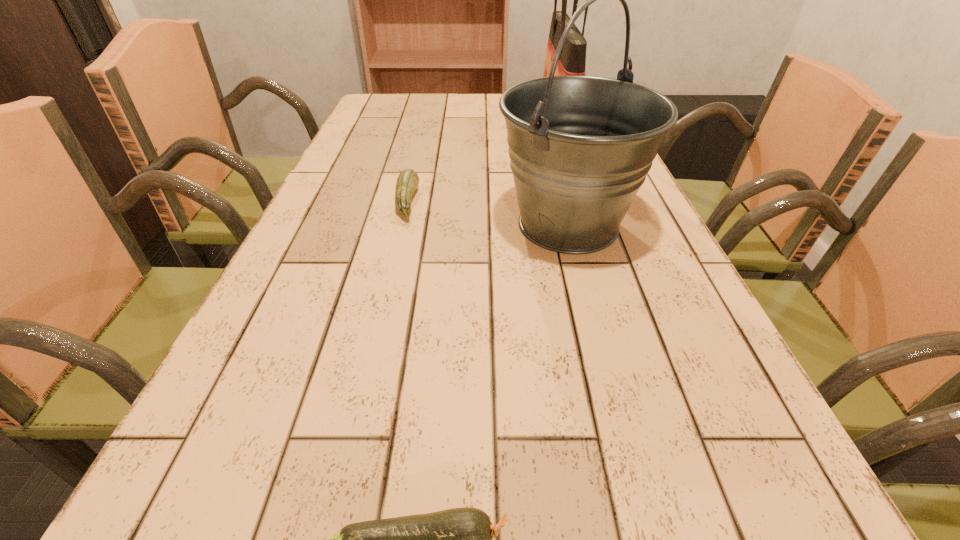
Where is `shopping bag that is at the right edge`? This screenshot has width=960, height=540. shopping bag that is at the right edge is located at coordinates (572, 61).

At what (x,y) coordinates should I click in order to perform the action: click on bucket present at the right edge. Please return your answer as a coordinate pair (x, y). Looking at the image, I should click on (580, 147).

In order to click on object at the far right corner in this screenshot , I will do tap(572, 61).

Where is `free space at the far edge of the desktop`? This screenshot has width=960, height=540. free space at the far edge of the desktop is located at coordinates (496, 115).

Where is `free region at the left edge`? free region at the left edge is located at coordinates (342, 150).

Identify the location of vacant space at the right edge. (642, 316).

The width and height of the screenshot is (960, 540). Identify the location of vacant space at the far left corner of the desktop. (388, 97).

The width and height of the screenshot is (960, 540). What are the coordinates of `empty space between the third shortest object and the farther zucchini` in the screenshot? It's located at (488, 213).

Identify which object is the nearest to the nearer zucchini. Please provide its 2D coordinates. Your answer should be formatted as a tuple, i.e. [(x, y)], where the tuple contains the x and y coordinates of a point satisfying the conditions above.

[(580, 147)]

Locate an element on the screen. The height and width of the screenshot is (540, 960). the second closest object to the farther zucchini is located at coordinates (572, 61).